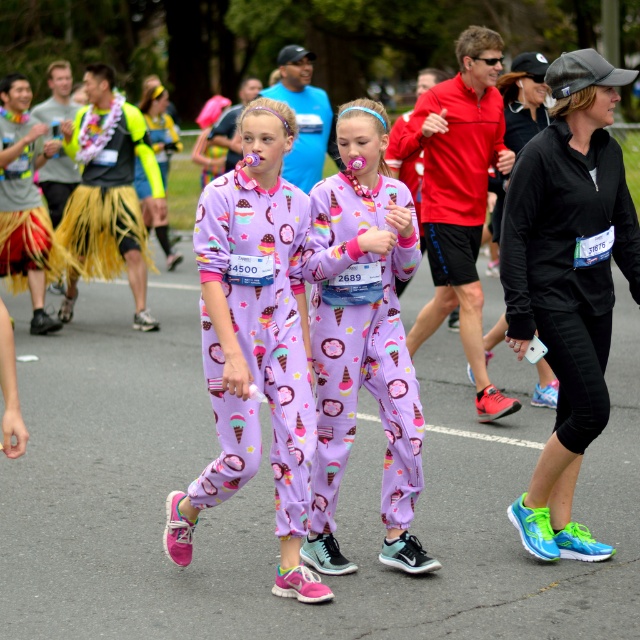
Question: Which of the following is the closest to the observer?

Choices:
 (A) (403, 496)
 (B) (220, 461)
 (C) (620, 196)

Answer: (B)

Question: Can you confirm if neon green running shoes at center is wider than lavender soft fabric onesie at center?

Choices:
 (A) no
 (B) yes

Answer: (B)

Question: Is purple cotton onesie at center bigger than lavender soft fabric onesie at center?

Choices:
 (A) no
 (B) yes

Answer: (B)

Question: In this image, where is purple cotton onesie at center located relative to lavender soft fabric onesie at center?

Choices:
 (A) above
 (B) below

Answer: (B)

Question: Among these objects, which one is farthest from the camera?

Choices:
 (A) neon green running shoes at center
 (B) purple cotton onesie at center

Answer: (A)

Question: Which point is farther from the camera taking this photo?

Choices:
 (A) (616, 188)
 (B) (285, 120)
 (C) (310, 333)

Answer: (A)